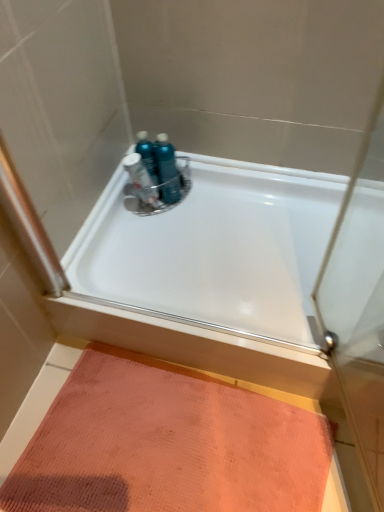
Where is `free space to the left of translucent plastic bottles at center, which is the first toiletry from left to right`? Image resolution: width=384 pixels, height=512 pixels. free space to the left of translucent plastic bottles at center, which is the first toiletry from left to right is located at coordinates (119, 214).